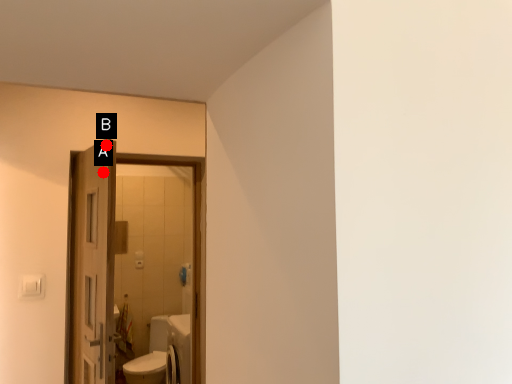
Question: Two points are circled on the image, labeled by A and B beside each circle. Among these points, which one is farthest from the camera?

Choices:
 (A) A is further
 (B) B is further

Answer: (B)